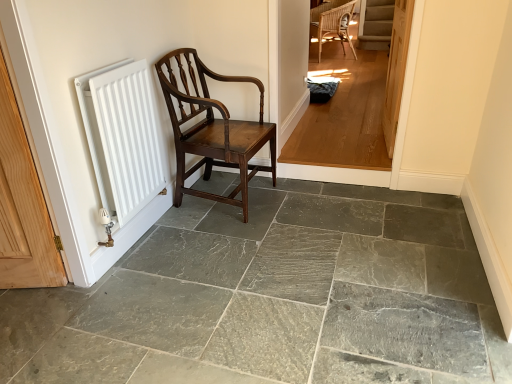
Question: Considering the relative sizes of polished dark wood chair at left and white matte radiator at left in the image provided, is polished dark wood chair at left smaller than white matte radiator at left?

Choices:
 (A) no
 (B) yes

Answer: (A)

Question: Considering the relative sizes of polished dark wood chair at left and white matte radiator at left in the image provided, is polished dark wood chair at left thinner than white matte radiator at left?

Choices:
 (A) yes
 (B) no

Answer: (B)

Question: From a real-world perspective, is polished dark wood chair at left over white matte radiator at left?

Choices:
 (A) yes
 (B) no

Answer: (B)

Question: Is polished dark wood chair at left far away from white matte radiator at left?

Choices:
 (A) no
 (B) yes

Answer: (A)

Question: From the image's perspective, is polished dark wood chair at left under white matte radiator at left?

Choices:
 (A) yes
 (B) no

Answer: (B)

Question: Is point (395, 77) positioned closer to the camera than point (266, 370)?

Choices:
 (A) farther
 (B) closer

Answer: (A)

Question: Is light brown wooden door at center taller or shorter than gray slate floor at center?

Choices:
 (A) short
 (B) tall

Answer: (B)

Question: From the image's perspective, is light brown wooden door at center above or below gray slate floor at center?

Choices:
 (A) below
 (B) above

Answer: (B)

Question: Is light brown wooden door at center bigger or smaller than gray slate floor at center?

Choices:
 (A) small
 (B) big

Answer: (A)

Question: Relative to white matte radiator at left, is gray slate floor at center in front or behind?

Choices:
 (A) front
 (B) behind

Answer: (A)

Question: Considering the positions of gray slate floor at center and white matte radiator at left in the image, is gray slate floor at center wider or thinner than white matte radiator at left?

Choices:
 (A) thin
 (B) wide

Answer: (B)

Question: Considering the positions of gray slate floor at center and white matte radiator at left in the image, is gray slate floor at center taller or shorter than white matte radiator at left?

Choices:
 (A) short
 (B) tall

Answer: (A)

Question: Considering the positions of point (155, 304) and point (97, 187), is point (155, 304) closer or farther from the camera than point (97, 187)?

Choices:
 (A) farther
 (B) closer

Answer: (B)

Question: Considering the relative positions of polished dark wood chair at left and white matte radiator at left in the image provided, is polished dark wood chair at left to the left or to the right of white matte radiator at left?

Choices:
 (A) left
 (B) right

Answer: (B)

Question: Is polished dark wood chair at left spatially inside white matte radiator at left, or outside of it?

Choices:
 (A) outside
 (B) inside

Answer: (A)